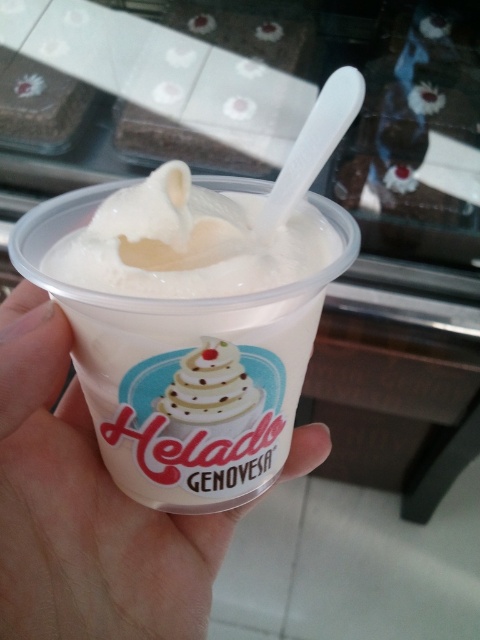
Which is more to the left, transparent plastic cup at center or white matte plastic cup at center?

From the viewer's perspective, transparent plastic cup at center appears more on the left side.

Between transparent plastic cup at center and white matte plastic cup at center, which one is positioned lower?

A: transparent plastic cup at center

Is point (192, 524) behind point (266, 324)?

Yes.

Locate an element on the screen. The image size is (480, 640). transparent plastic cup at center is located at coordinates (84, 509).